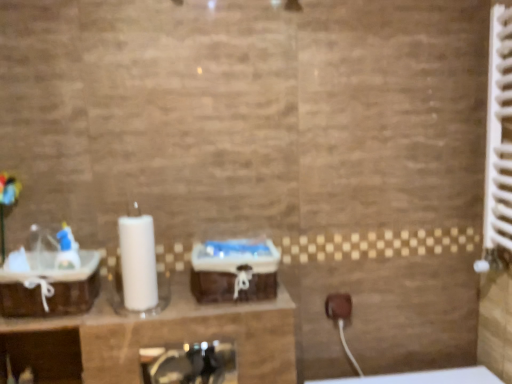
This screenshot has height=384, width=512. In order to click on vacant area on top of brown woven basket at left (from a real-world perspective) in this screenshot , I will do `click(65, 264)`.